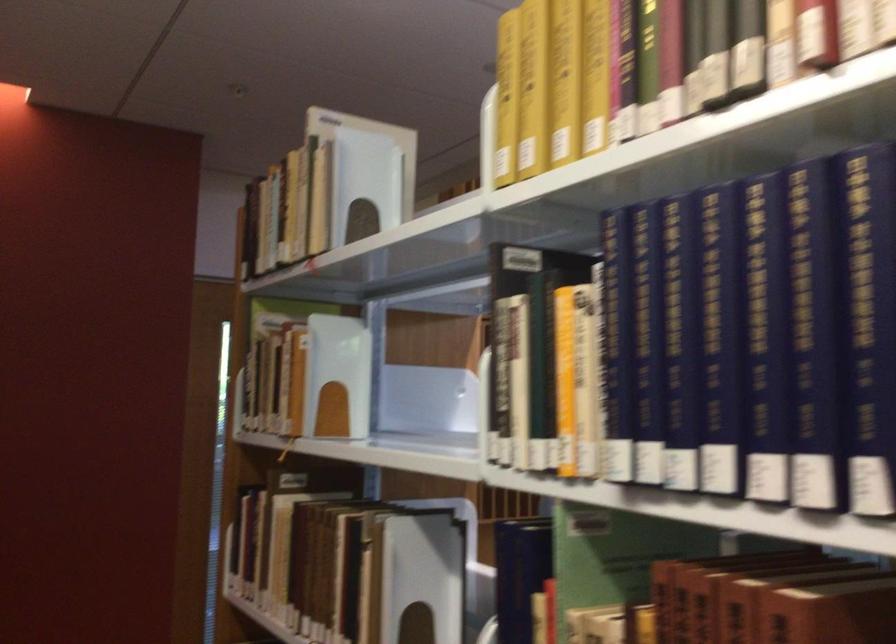
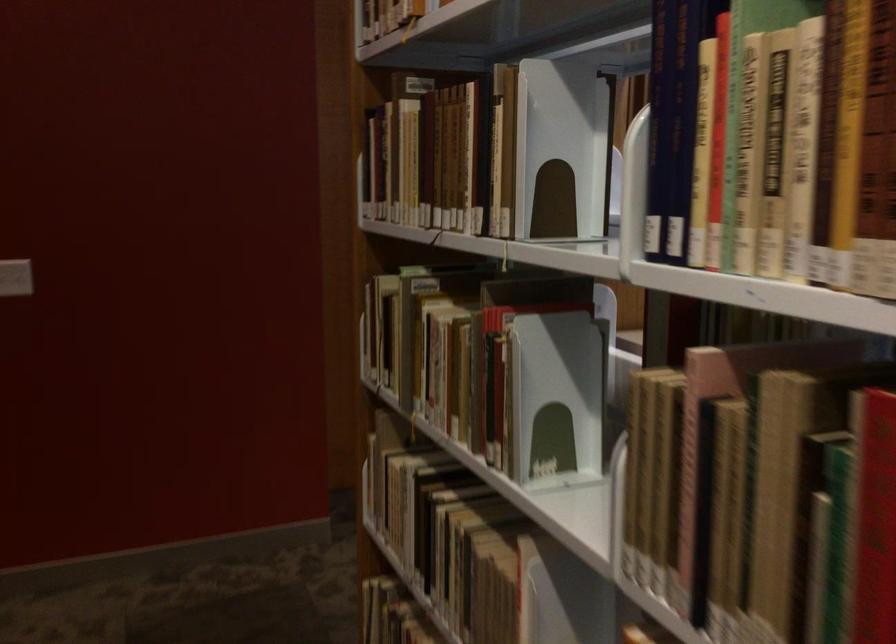
The point at (x=295, y=569) is marked in the first image. Where is the corresponding point in the second image?

(425, 158)